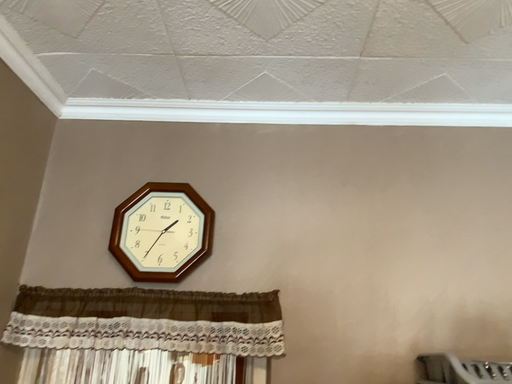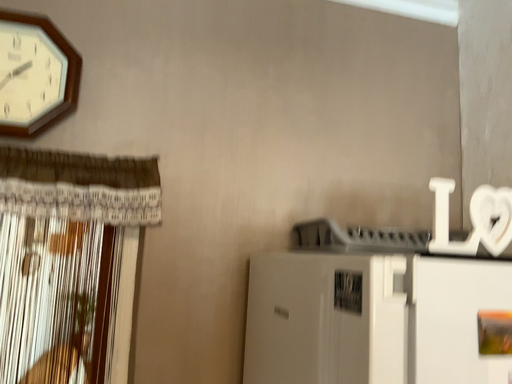
Question: Which way did the camera rotate in the video?

Choices:
 (A) rotated upward
 (B) rotated downward

Answer: (B)